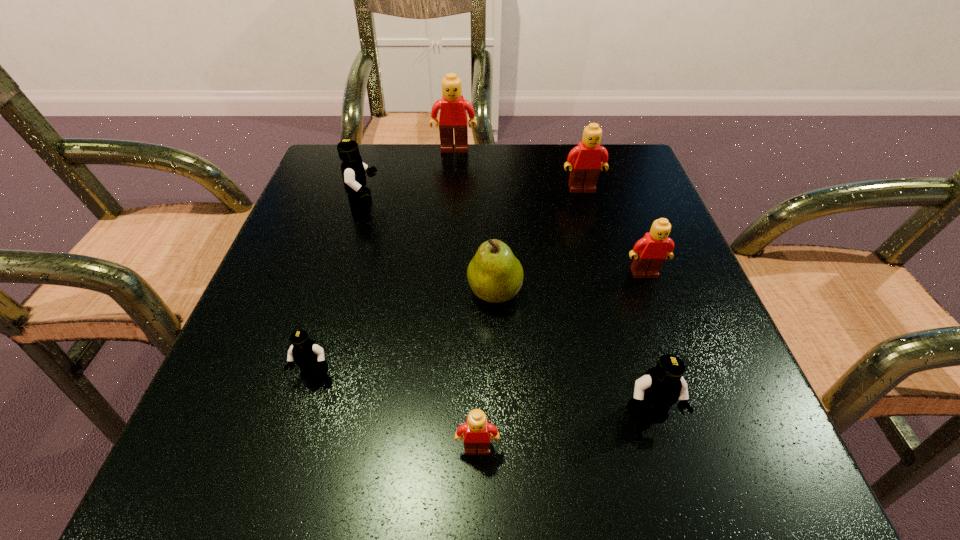
I want to click on free space between the smallest brown Lego and the second nearest Lego, so click(563, 432).

You are a GUI agent. You are given a task and a screenshot of the screen. Output one action in this format:
    pyautogui.click(x=<x>, y=<y>)
    Task: Click on the free area in between the second smallest brown Lego and the pear
    The width and height of the screenshot is (960, 540).
    Given the screenshot: What is the action you would take?
    pyautogui.click(x=569, y=283)

You are a GUI agent. You are given a task and a screenshot of the screen. Output one action in this format:
    pyautogui.click(x=<x>, y=<y>)
    Task: Click on the free spot between the second farthest brown Lego and the second nearest black Lego
    The width and height of the screenshot is (960, 540).
    Given the screenshot: What is the action you would take?
    pyautogui.click(x=448, y=282)

Where is `free space between the second biggest black Lego and the farthest black Lego`? The image size is (960, 540). free space between the second biggest black Lego and the farthest black Lego is located at coordinates (507, 310).

Where is `free space between the nearest Lego and the second biggest brown Lego`? The image size is (960, 540). free space between the nearest Lego and the second biggest brown Lego is located at coordinates (530, 319).

This screenshot has width=960, height=540. In order to click on vacant space in between the nearest object and the farthest brown Lego in this screenshot , I will do `click(466, 299)`.

At what (x,y) coordinates should I click in order to perform the action: click on vacant area that lies between the pear and the nearest brown Lego. Please return your answer as a coordinate pair (x, y). Looking at the image, I should click on (486, 370).

Where is `free area in between the seventh farthest object and the second farthest brown Lego`? Image resolution: width=960 pixels, height=540 pixels. free area in between the seventh farthest object and the second farthest brown Lego is located at coordinates (615, 302).

Point out which object is positioned as the sixth nearest to the pear. Please provide its 2D coordinates. Your answer should be formatted as a tuple, i.e. [(x, y)], where the tuple contains the x and y coordinates of a point satisfying the conditions above.

[(585, 163)]

Select which object is the sixth closest to the farthest black Lego. Please provide its 2D coordinates. Your answer should be formatted as a tuple, i.e. [(x, y)], where the tuple contains the x and y coordinates of a point satisfying the conditions above.

[(477, 430)]